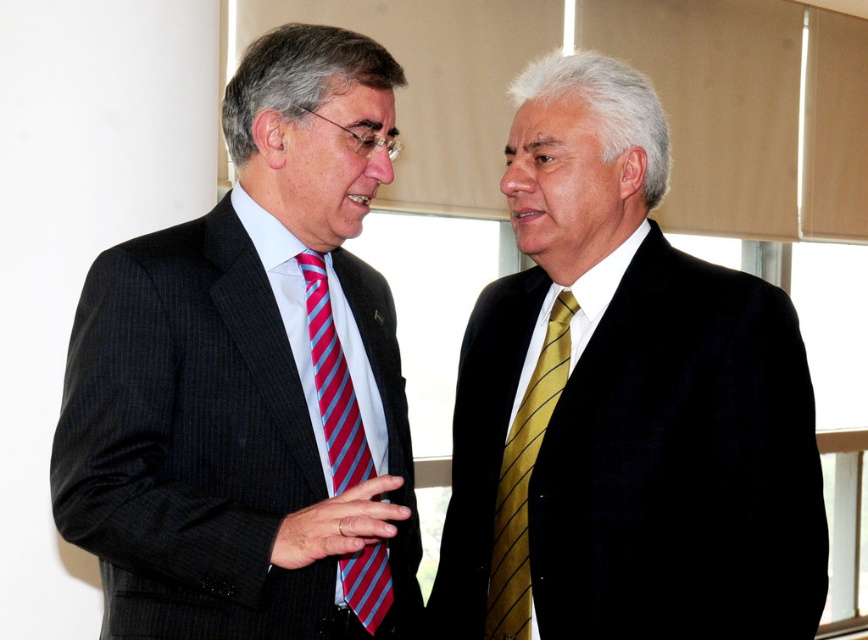
Question: Among these points, which one is nearest to the camera?

Choices:
 (A) (365, 477)
 (B) (248, 179)
 (C) (602, 621)
 (D) (502, 508)

Answer: (C)

Question: Where is matte black suit at right located in relation to gold striped tie at right in the image?

Choices:
 (A) above
 (B) below

Answer: (A)

Question: Estimate the real-world distances between objects in this image. Which object is farther from the striped silk tie at left?

Choices:
 (A) matte black suit at right
 (B) matte black suit at left
 (C) gold striped tie at right

Answer: (A)

Question: Which point appears closest to the camera in this image?

Choices:
 (A) coord(584,86)
 (B) coord(531,449)
 (C) coord(181,385)
 (D) coord(319,339)

Answer: (C)

Question: Is matte black suit at left to the left of matte black suit at right from the viewer's perspective?

Choices:
 (A) yes
 (B) no

Answer: (A)

Question: Is matte black suit at right wider than gold striped tie at right?

Choices:
 (A) no
 (B) yes

Answer: (B)